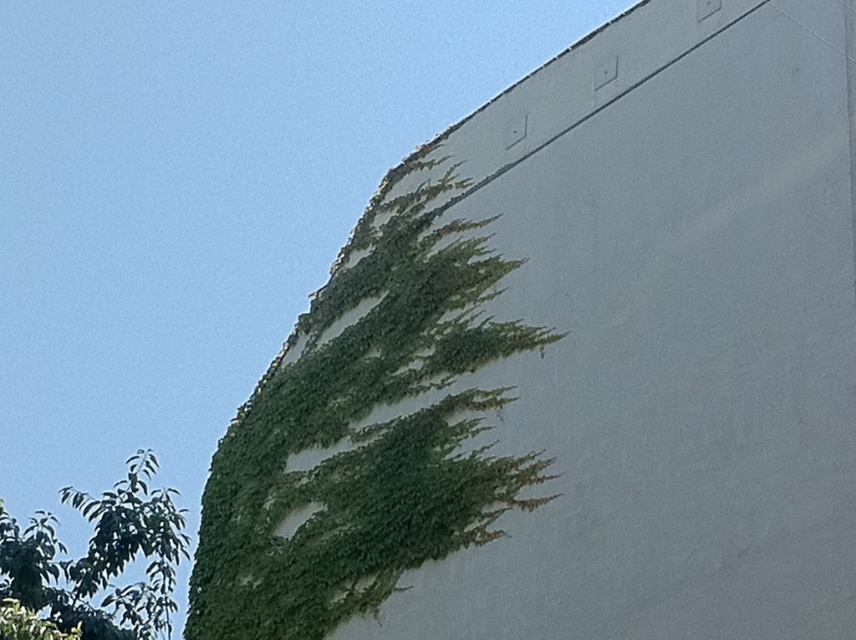
Does green leafy ivy at upper left appear under green leafy tree at lower left?

No.

What do you see at coordinates (364, 435) in the screenshot? I see `green leafy ivy at upper left` at bounding box center [364, 435].

Image resolution: width=856 pixels, height=640 pixels. I want to click on green leafy ivy at upper left, so click(x=364, y=435).